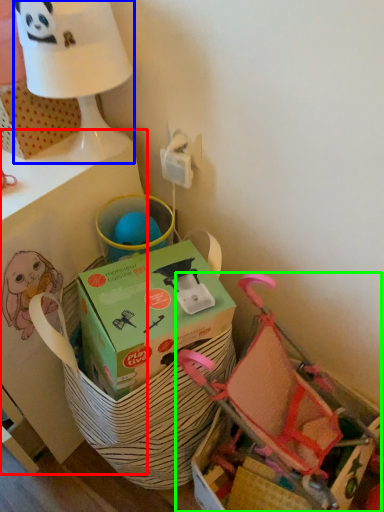
Question: Which object is positioned farthest from table (highlighted by a red box)? Select from table lamp (highlighted by a blue box) and baby carriage (highlighted by a green box).

Choices:
 (A) table lamp
 (B) baby carriage

Answer: (B)